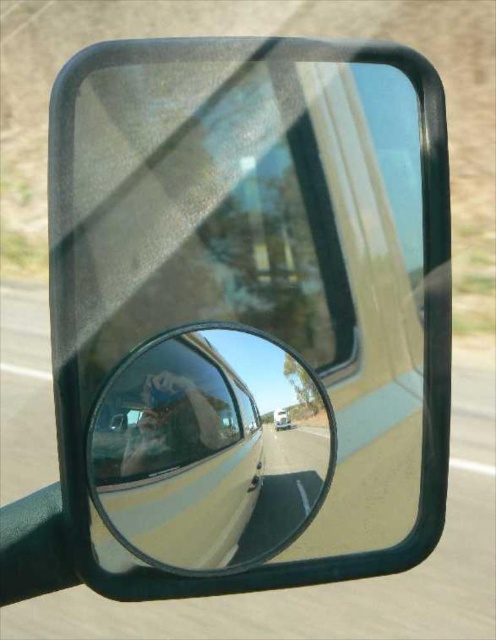
Which is behind, point (181, 420) or point (273, 419)?

Positioned behind is point (273, 419).

Can you confirm if clear glass mirror at center is positioned to the left of white glossy truck at center?

Indeed, clear glass mirror at center is positioned on the left side of white glossy truck at center.

Is point (215, 508) positioned before point (280, 426)?

Yes, point (215, 508) is in front of point (280, 426).

What are the coordinates of `clear glass mirror at center` in the screenshot? It's located at (209, 449).

The width and height of the screenshot is (496, 640). I want to click on matte plastic selfie at center, so click(172, 426).

Who is more distant from viewer, [151,428] or [285,419]?

Point [285,419]

Between point (208, 406) and point (287, 419), which one is positioned in front?

Positioned in front is point (208, 406).

At what (x,y) coordinates should I click in order to perform the action: click on matte plastic selfie at center. Please return your answer as a coordinate pair (x, y). Looking at the image, I should click on (172, 426).

Consider the image. How much distance is there between clear glass mirror at center and matte plastic selfie at center?

The distance of clear glass mirror at center from matte plastic selfie at center is 0.76 inches.

Looking at this image, between clear glass mirror at center and matte plastic selfie at center, which one appears on the left side from the viewer's perspective?

matte plastic selfie at center

Find the location of `clear glass mirror at center`. clear glass mirror at center is located at coordinates (209, 449).